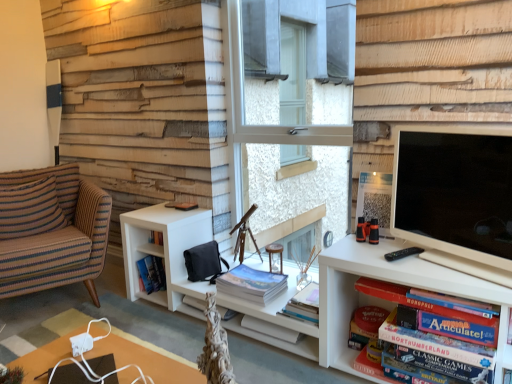
Question: Does matte white tv at right have a lesser height compared to matte board game at lower right, acting as the second book starting from the back?

Choices:
 (A) no
 (B) yes

Answer: (A)

Question: From the image's perspective, is matte white tv at right on top of matte board game at lower right, which ranks as the first book in right-to-left order?

Choices:
 (A) no
 (B) yes

Answer: (B)

Question: Is the depth of matte white tv at right greater than that of matte board game at lower right, placed as the 1th book when sorted from front to back?

Choices:
 (A) no
 (B) yes

Answer: (A)

Question: From a real-world perspective, is matte white tv at right below matte board game at lower right, acting as the second book starting from the back?

Choices:
 (A) yes
 (B) no

Answer: (B)

Question: From the image's perspective, would you say matte white tv at right is shown under matte board game at lower right, placed as the second book when sorted from left to right?

Choices:
 (A) no
 (B) yes

Answer: (A)

Question: Is matte white tv at right not near matte board game at lower right, placed as the second book when sorted from left to right?

Choices:
 (A) yes
 (B) no

Answer: (B)

Question: Does striped fabric pillow at left have a larger size compared to clear glass window at center?

Choices:
 (A) no
 (B) yes

Answer: (A)

Question: Is striped fabric pillow at left at the right side of clear glass window at center?

Choices:
 (A) yes
 (B) no

Answer: (B)

Question: Is striped fabric pillow at left far away from clear glass window at center?

Choices:
 (A) no
 (B) yes

Answer: (B)

Question: From the image's perspective, would you say striped fabric pillow at left is shown under clear glass window at center?

Choices:
 (A) yes
 (B) no

Answer: (A)

Question: Are striped fabric pillow at left and clear glass window at center making contact?

Choices:
 (A) yes
 (B) no

Answer: (B)

Question: From a real-world perspective, is striped fabric pillow at left on clear glass window at center?

Choices:
 (A) yes
 (B) no

Answer: (B)

Question: Is matte white tv at right surrounded by striped fabric pillow at left?

Choices:
 (A) no
 (B) yes

Answer: (A)